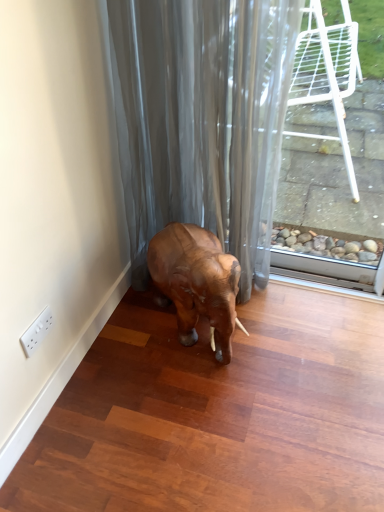
Question: Is satin gray curtain at lower center at the left side of brown wooden elephant at center?

Choices:
 (A) no
 (B) yes

Answer: (B)

Question: Is satin gray curtain at lower center behind brown wooden elephant at center?

Choices:
 (A) yes
 (B) no

Answer: (B)

Question: From a real-world perspective, is satin gray curtain at lower center on top of brown wooden elephant at center?

Choices:
 (A) yes
 (B) no

Answer: (A)

Question: Can you confirm if satin gray curtain at lower center is shorter than brown wooden elephant at center?

Choices:
 (A) yes
 (B) no

Answer: (B)

Question: Can you see satin gray curtain at lower center touching brown wooden elephant at center?

Choices:
 (A) yes
 (B) no

Answer: (B)

Question: Is brown wooden elephant at center completely or partially inside satin gray curtain at lower center?

Choices:
 (A) yes
 (B) no

Answer: (A)

Question: Can you confirm if brown wooden elephant at center is smaller than satin gray curtain at lower center?

Choices:
 (A) no
 (B) yes

Answer: (B)

Question: Would you say brown wooden elephant at center contains satin gray curtain at lower center?

Choices:
 (A) no
 (B) yes

Answer: (A)

Question: Is brown wooden elephant at center behind satin gray curtain at lower center?

Choices:
 (A) yes
 (B) no

Answer: (A)

Question: Can you confirm if brown wooden elephant at center is taller than satin gray curtain at lower center?

Choices:
 (A) yes
 (B) no

Answer: (B)

Question: Is brown wooden elephant at center aimed at satin gray curtain at lower center?

Choices:
 (A) no
 (B) yes

Answer: (A)

Question: Is brown wooden elephant at center not within satin gray curtain at lower center?

Choices:
 (A) yes
 (B) no

Answer: (B)

Question: From the image's perspective, is brown wooden elephant at center positioned above or below satin gray curtain at lower center?

Choices:
 (A) above
 (B) below

Answer: (B)